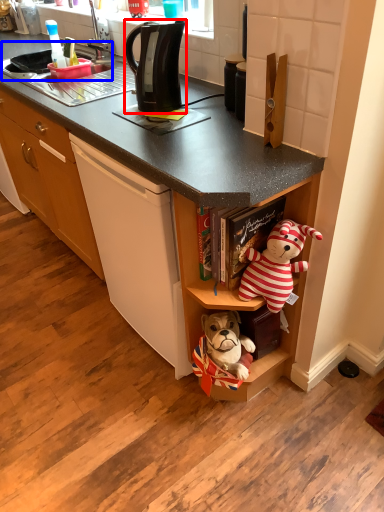
Question: Among these objects, which one is nearest to the camera, kitchen appliance (highlighted by a red box) or sink (highlighted by a blue box)?

Choices:
 (A) kitchen appliance
 (B) sink

Answer: (A)